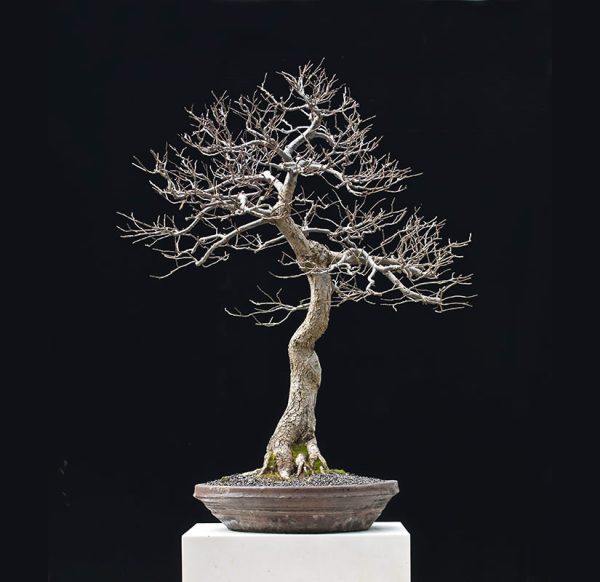
Find the location of `bowl`. bowl is located at coordinates (316, 511).